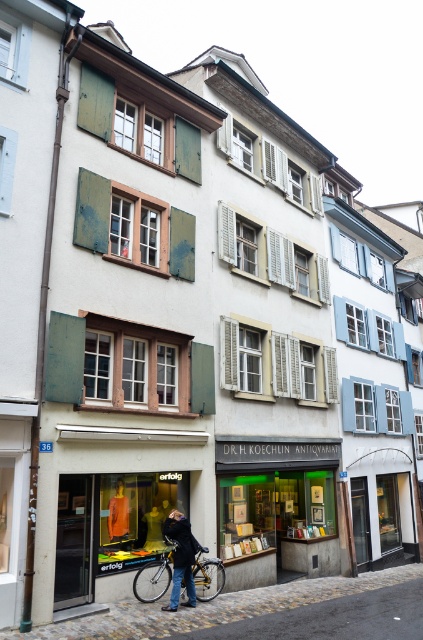
Is point (164, 557) positioned in front of point (192, 596)?

No, (164, 557) is further to viewer.

Is silver metallic bicycle at center behind dark blue leather jacket at center?

Yes, silver metallic bicycle at center is further from the viewer.

Find the location of a particular element. silver metallic bicycle at center is located at coordinates (154, 576).

Where is `silver metallic bicycle at center`? This screenshot has width=423, height=640. silver metallic bicycle at center is located at coordinates (154, 576).